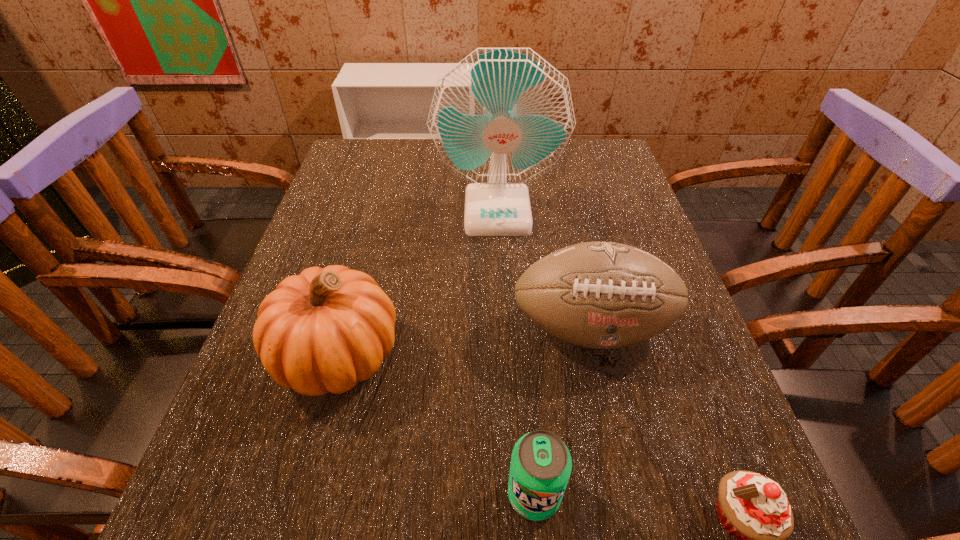
I want to click on free area in between the football (American) and the pop soda, so click(563, 411).

Where is `vacant region between the football (American) and the leftmost object`? This screenshot has height=540, width=960. vacant region between the football (American) and the leftmost object is located at coordinates (465, 342).

Identify the location of free space between the pumpkin and the pop soda. The height and width of the screenshot is (540, 960). (436, 424).

The width and height of the screenshot is (960, 540). Identify the location of the second closest object to the football (American). (500, 118).

Image resolution: width=960 pixels, height=540 pixels. Identify the location of object that is the fourth closest to the cupcake. (500, 118).